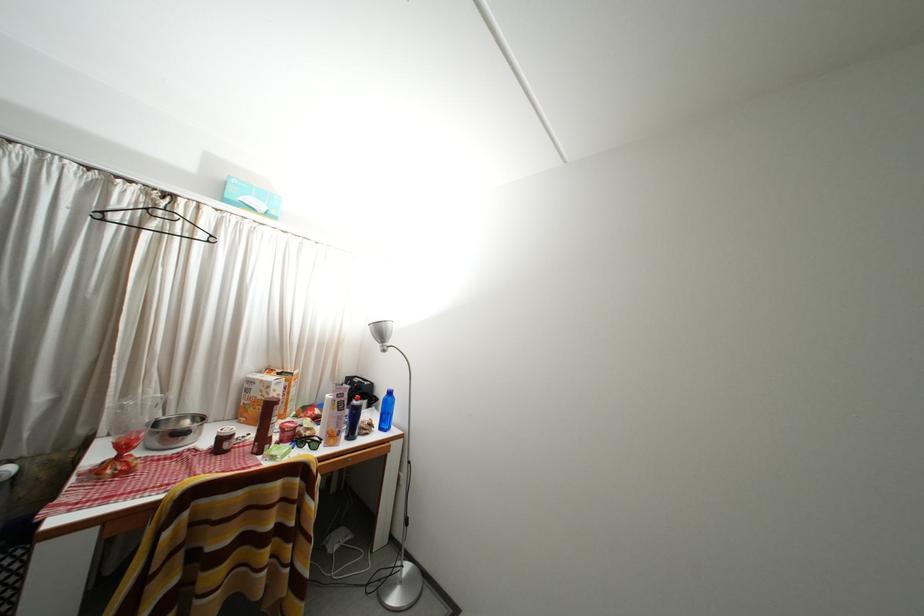
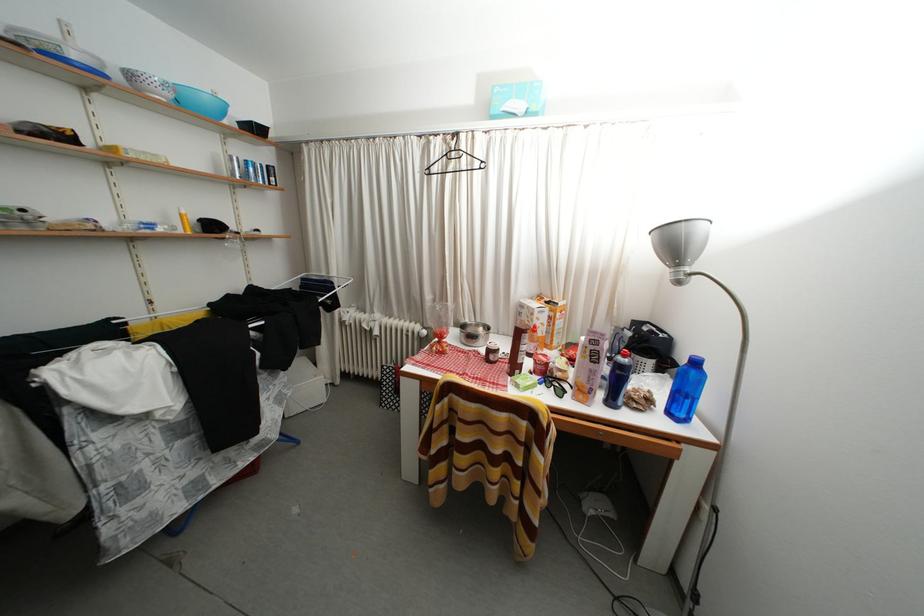
Locate, in the second image, the point that corresponds to [359,442] in the first image.

(618, 408)